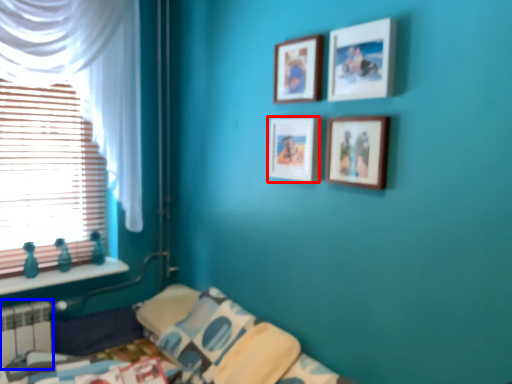
Question: Which point is further to the camera, picture frame (highlighted by a red box) or radiator (highlighted by a blue box)?

Choices:
 (A) picture frame
 (B) radiator

Answer: (B)